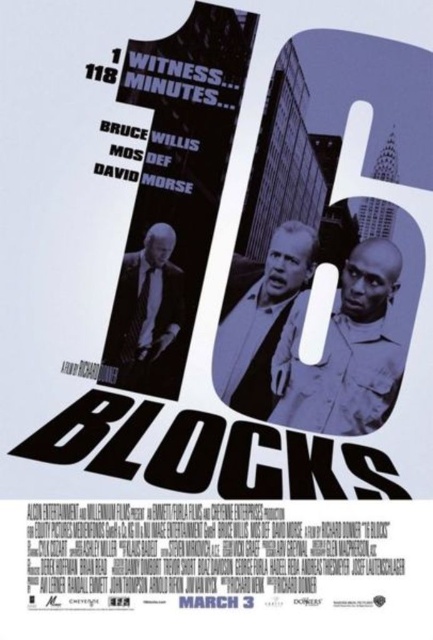
Question: Which point is farther to the camera?

Choices:
 (A) (161, 385)
 (B) (283, 307)
 (C) (348, 360)

Answer: (A)

Question: Can you confirm if gray matte suit at center is wider than matte black suit at lower left?

Choices:
 (A) yes
 (B) no

Answer: (A)

Question: Observing the image, what is the correct spatial positioning of matte black shirt at center in reference to matte black suit at lower left?

Choices:
 (A) left
 (B) right

Answer: (B)

Question: Is gray matte suit at center wider than matte black suit at lower left?

Choices:
 (A) no
 (B) yes

Answer: (B)

Question: Which of these objects is positioned farthest from the matte black suit at lower left?

Choices:
 (A) gray matte suit at center
 (B) matte black shirt at center

Answer: (B)

Question: Which is nearer to the gray matte suit at center?

Choices:
 (A) matte black suit at lower left
 (B) matte black shirt at center

Answer: (B)